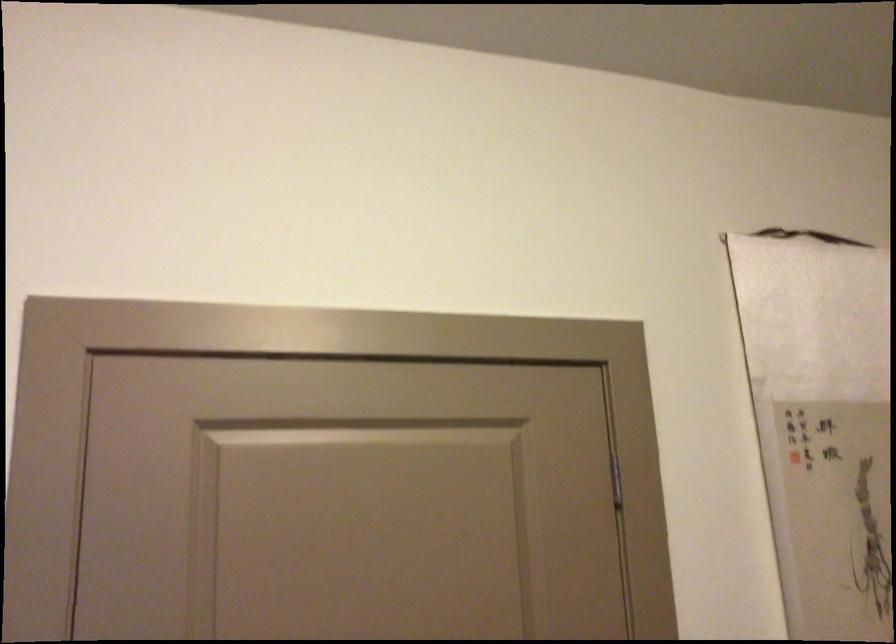
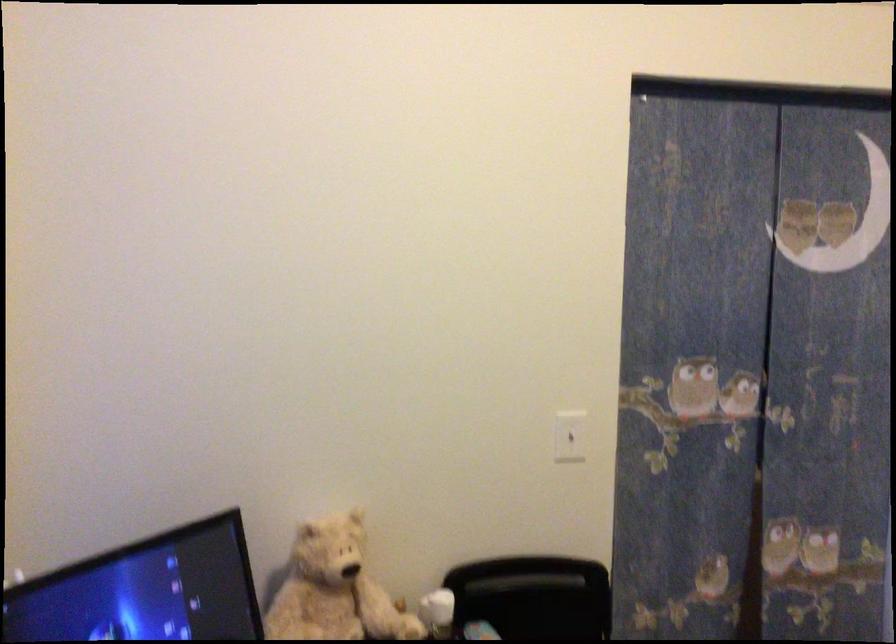
Question: The camera is either moving clockwise (left) or counter-clockwise (right) around the object. The first image is from the beginning of the video and the second image is from the end. Is the camera moving left or right when shooting the video?

Choices:
 (A) Left
 (B) Right

Answer: (B)